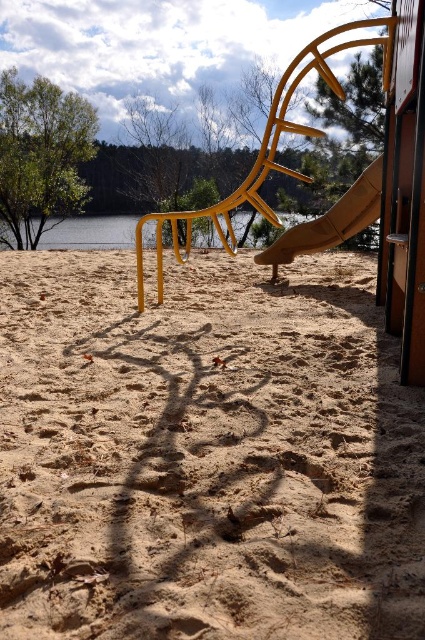
You are a child playing on the playground and want to reach the water to throw a stone. The brown sandy ground at center and transparent water at center are in your path. Which direction should you move to get to the water first?

The transparent water at center is to the left of the brown sandy ground at center. Since you want to reach the water first, you should move to the left where the transparent water at center is located.

You are a parent supervising children playing in the playground. You notice the brown sandy ground at center and the matte yellow slide at center. Which object is closer to the ground?

The brown sandy ground at center is located below the matte yellow slide at center, so the brown sandy ground at center is closer to the ground.